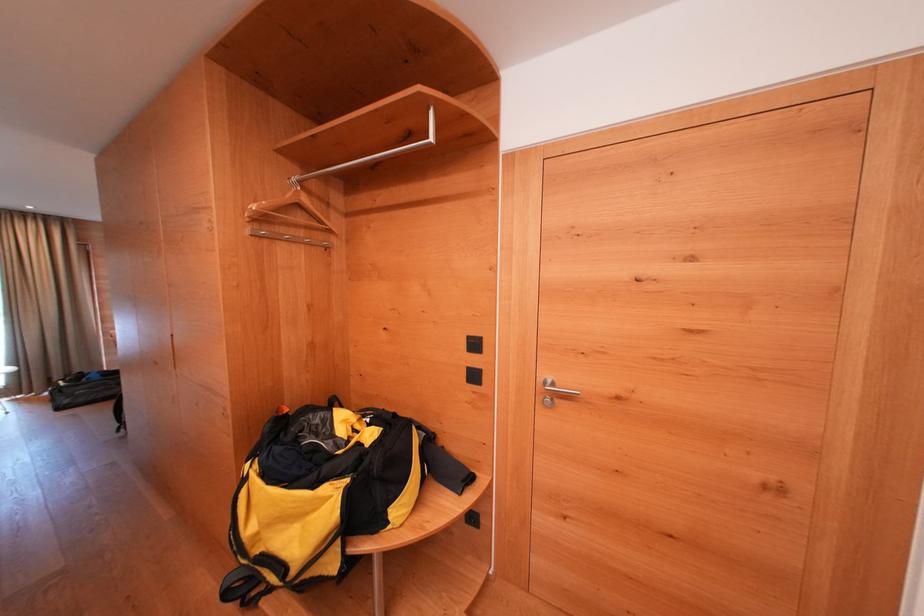
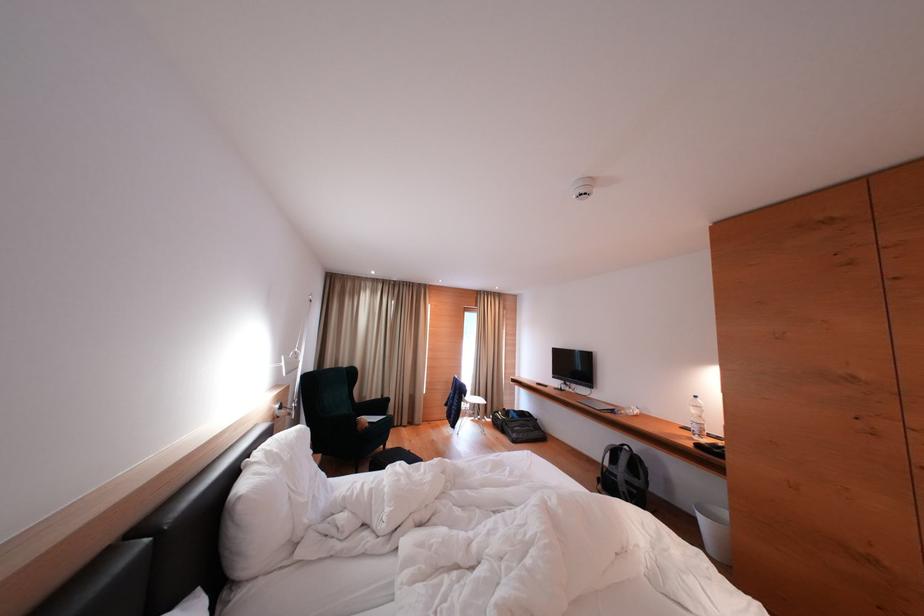
Where in the second image is the point corresponding to pixel 101 379 from the first image?

(518, 418)